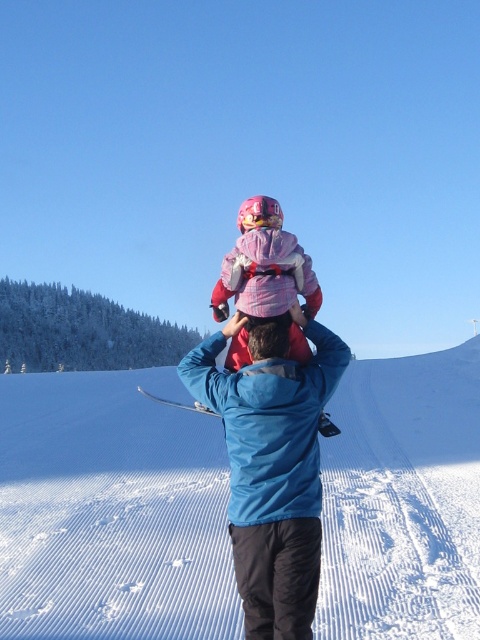
Question: Which of the following is the closest to the observer?

Choices:
 (A) white snow at center
 (B) blue fabric jacket at center
 (C) metallic silver ski at center
 (D) pink fleece jacket at center

Answer: (B)

Question: Can you confirm if pink fleece jacket at center is positioned below metallic silver ski at center?

Choices:
 (A) yes
 (B) no

Answer: (B)

Question: Among these points, which one is farthest from the camera?

Choices:
 (A) (255, 637)
 (B) (468, 476)
 (C) (193, 403)

Answer: (C)

Question: Is blue fabric jacket at center positioned in front of pink fleece jacket at center?

Choices:
 (A) yes
 (B) no

Answer: (A)

Question: Which of the following is the closest to the observer?

Choices:
 (A) pink fleece jacket at center
 (B) blue fabric jacket at center
 (C) metallic silver ski at center

Answer: (B)

Question: Does blue fabric jacket at center appear under metallic silver ski at center?

Choices:
 (A) yes
 (B) no

Answer: (B)